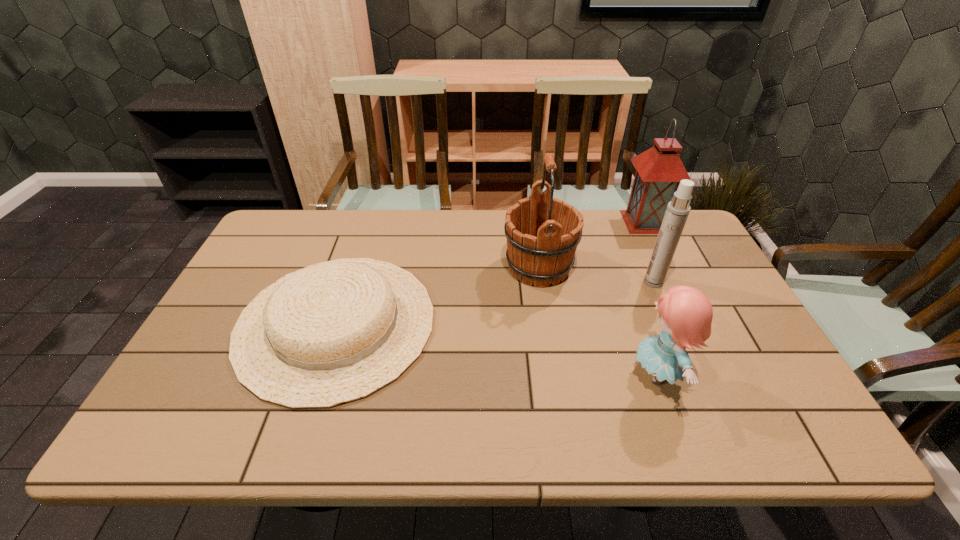
Find the location of `free space between the wine bucket and the second shortest object`. free space between the wine bucket and the second shortest object is located at coordinates (598, 321).

Identify the location of free space between the aerosol can and the sunhat. The width and height of the screenshot is (960, 540). (494, 302).

Where is `vacant area that lies between the aerosol can and the lantern`? vacant area that lies between the aerosol can and the lantern is located at coordinates (x=649, y=252).

The height and width of the screenshot is (540, 960). Find the location of `blank region between the sunhat and the second object from left to right`. blank region between the sunhat and the second object from left to right is located at coordinates (438, 295).

Locate an element on the screen. unoccupied position between the wine bucket and the lantern is located at coordinates (592, 244).

I want to click on free space between the doll and the fourth object from right to left, so click(598, 321).

Where is `empty space between the aerosol can and the wine bucket`? empty space between the aerosol can and the wine bucket is located at coordinates (596, 274).

Locate which object is the second closest to the aerosol can. Please provide its 2D coordinates. Your answer should be formatted as a tuple, i.e. [(x, y)], where the tuple contains the x and y coordinates of a point satisfying the conditions above.

[(542, 232)]

Locate which object is the second closest to the lantern. Please provide its 2D coordinates. Your answer should be formatted as a tuple, i.e. [(x, y)], where the tuple contains the x and y coordinates of a point satisfying the conditions above.

[(542, 232)]

The width and height of the screenshot is (960, 540). Identify the location of free spot that satisfies the following two spatial constraints: 1. on the front side of the aerosol can; 2. on the front-facing side of the second shortest object. (693, 374).